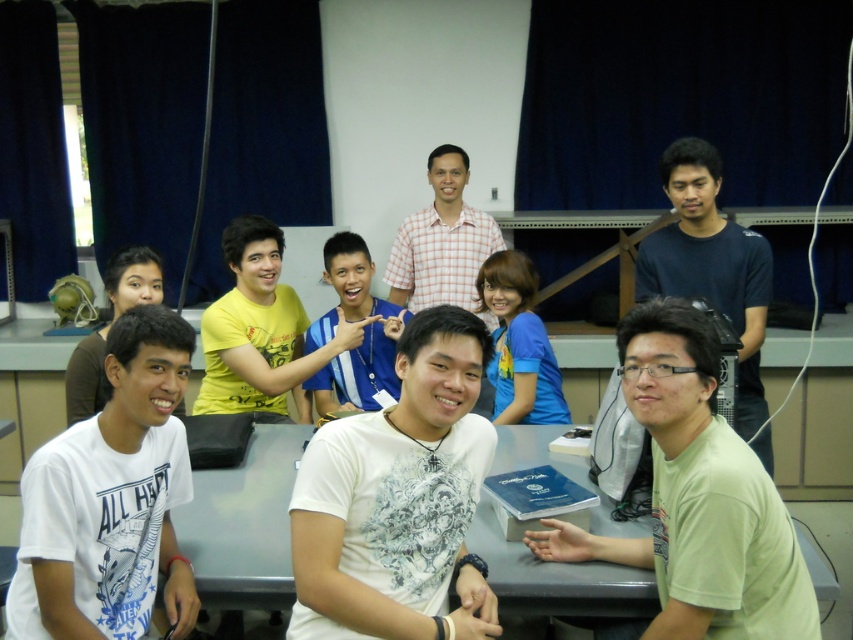
Question: Considering the real-world distances, which object is closest to the white matte shirt at center?

Choices:
 (A) gray plastic table at center
 (B) checkered fabric shirt at center

Answer: (A)

Question: Is white matte shirt at center closer to the viewer compared to green matte shirt at center?

Choices:
 (A) no
 (B) yes

Answer: (A)

Question: In this image, where is gray plastic table at center located relative to dark blue t-shirt at right?

Choices:
 (A) right
 (B) left

Answer: (B)

Question: Which of the following is the farthest from the observer?

Choices:
 (A) (715, 154)
 (B) (128, 513)

Answer: (A)

Question: Which point is closer to the camera?

Choices:
 (A) white matte shirt at center
 (B) white cotton t-shirt at lower left
 (C) dark blue t-shirt at right

Answer: (B)

Question: Observing the image, what is the correct spatial positioning of dark blue t-shirt at right in reference to yellow matte shirt at center?

Choices:
 (A) above
 (B) below

Answer: (A)